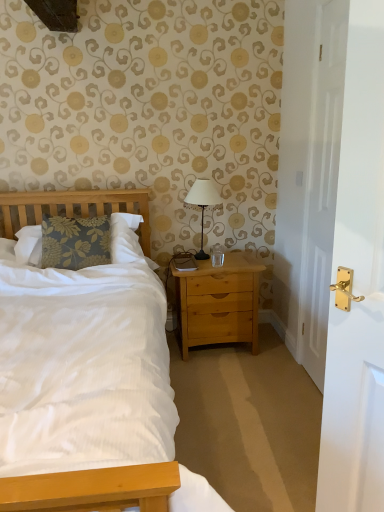
Question: Can you confirm if white glossy door at right is taller than light brown wood nightstand at right?

Choices:
 (A) no
 (B) yes

Answer: (B)

Question: From the image's perspective, is white glossy door at right located above light brown wood nightstand at right?

Choices:
 (A) no
 (B) yes

Answer: (B)

Question: Is white glossy door at right touching light brown wood nightstand at right?

Choices:
 (A) yes
 (B) no

Answer: (B)

Question: Considering the relative sizes of white glossy door at right and light brown wood nightstand at right in the image provided, is white glossy door at right shorter than light brown wood nightstand at right?

Choices:
 (A) yes
 (B) no

Answer: (B)

Question: Is white glossy door at right wider than light brown wood nightstand at right?

Choices:
 (A) no
 (B) yes

Answer: (A)

Question: Relative to light brown wood nightstand at right, is matte black lamp at center in front or behind?

Choices:
 (A) front
 (B) behind

Answer: (B)

Question: Would you say matte black lamp at center is to the left or to the right of light brown wood nightstand at right in the picture?

Choices:
 (A) right
 (B) left

Answer: (B)

Question: Which is correct: matte black lamp at center is inside light brown wood nightstand at right, or outside of it?

Choices:
 (A) inside
 (B) outside

Answer: (B)

Question: Considering the positions of matte black lamp at center and light brown wood nightstand at right in the image, is matte black lamp at center taller or shorter than light brown wood nightstand at right?

Choices:
 (A) short
 (B) tall

Answer: (A)

Question: Is point (192, 325) closer or farther from the camera than point (215, 200)?

Choices:
 (A) farther
 (B) closer

Answer: (B)

Question: Is light brown wood nightstand at right to the left or to the right of matte black lamp at center in the image?

Choices:
 (A) left
 (B) right

Answer: (B)

Question: Is light brown wood nightstand at right wider or thinner than matte black lamp at center?

Choices:
 (A) thin
 (B) wide

Answer: (B)

Question: From their relative heights in the image, would you say light brown wood nightstand at right is taller or shorter than matte black lamp at center?

Choices:
 (A) short
 (B) tall

Answer: (B)

Question: Do you think white glossy door at right is within matte black lamp at center, or outside of it?

Choices:
 (A) outside
 (B) inside

Answer: (A)

Question: Looking at their shapes, would you say white glossy door at right is wider or thinner than matte black lamp at center?

Choices:
 (A) thin
 (B) wide

Answer: (A)